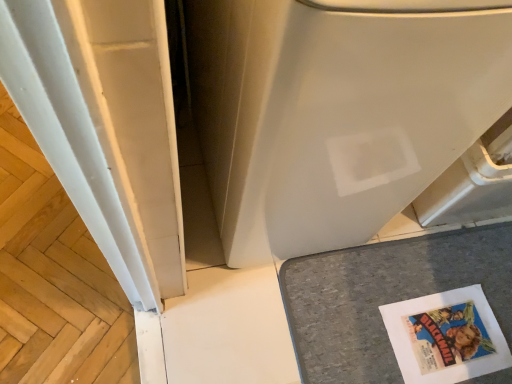
Question: Is white matte water heater at center positioned behind gray felt mat at lower right?

Choices:
 (A) no
 (B) yes

Answer: (A)

Question: Could gray felt mat at lower right be considered to be inside white matte water heater at center?

Choices:
 (A) no
 (B) yes

Answer: (A)

Question: From a real-world perspective, is white matte water heater at center physically above gray felt mat at lower right?

Choices:
 (A) yes
 (B) no

Answer: (A)

Question: Are white matte water heater at center and gray felt mat at lower right far apart?

Choices:
 (A) no
 (B) yes

Answer: (A)

Question: Considering the relative sizes of white matte water heater at center and gray felt mat at lower right in the image provided, is white matte water heater at center smaller than gray felt mat at lower right?

Choices:
 (A) yes
 (B) no

Answer: (B)

Question: Visually, is white smooth wood at left positioned to the left or to the right of white matte water heater at center?

Choices:
 (A) left
 (B) right

Answer: (A)

Question: In the image, is white smooth wood at left positioned in front of or behind white matte water heater at center?

Choices:
 (A) front
 (B) behind

Answer: (B)

Question: Is white smooth wood at left taller or shorter than white matte water heater at center?

Choices:
 (A) tall
 (B) short

Answer: (B)

Question: Is white smooth wood at left bigger or smaller than white matte water heater at center?

Choices:
 (A) big
 (B) small

Answer: (B)

Question: Is gray felt mat at lower right spatially inside white matte water heater at center, or outside of it?

Choices:
 (A) inside
 (B) outside

Answer: (B)

Question: From the image's perspective, is gray felt mat at lower right positioned above or below white matte water heater at center?

Choices:
 (A) above
 (B) below

Answer: (B)

Question: Looking at the image, does gray felt mat at lower right seem bigger or smaller compared to white matte water heater at center?

Choices:
 (A) big
 (B) small

Answer: (B)

Question: From a real-world perspective, is gray felt mat at lower right above or below white matte water heater at center?

Choices:
 (A) below
 (B) above

Answer: (A)

Question: Is white matte water heater at center inside or outside of white smooth wood at left?

Choices:
 (A) outside
 (B) inside

Answer: (A)

Question: In the image, is white matte water heater at center positioned in front of or behind white smooth wood at left?

Choices:
 (A) front
 (B) behind

Answer: (A)